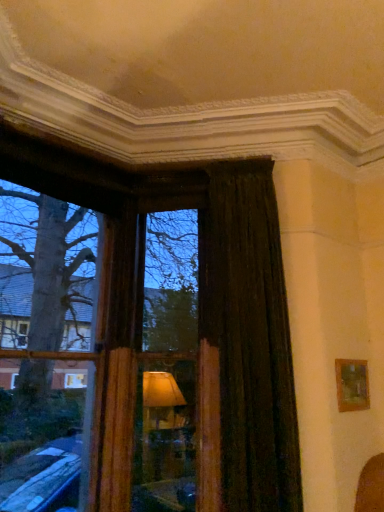
Question: Should I look upward or downward to see wooden picture frame at right?

Choices:
 (A) up
 (B) down

Answer: (B)

Question: Is wooden picture frame at right aimed at wooden frame at left?

Choices:
 (A) yes
 (B) no

Answer: (B)

Question: Considering the relative sizes of wooden picture frame at right and wooden frame at left in the image provided, is wooden picture frame at right taller than wooden frame at left?

Choices:
 (A) yes
 (B) no

Answer: (B)

Question: Is wooden picture frame at right shorter than wooden frame at left?

Choices:
 (A) yes
 (B) no

Answer: (A)

Question: From the image's perspective, is wooden picture frame at right under wooden frame at left?

Choices:
 (A) yes
 (B) no

Answer: (A)

Question: Is wooden picture frame at right outside wooden frame at left?

Choices:
 (A) yes
 (B) no

Answer: (A)

Question: Is wooden picture frame at right bigger than wooden frame at left?

Choices:
 (A) no
 (B) yes

Answer: (A)

Question: Can you confirm if wooden picture frame at right is bigger than wooden frame at center?

Choices:
 (A) yes
 (B) no

Answer: (B)

Question: Does wooden picture frame at right have a greater width compared to wooden frame at center?

Choices:
 (A) no
 (B) yes

Answer: (A)

Question: From the image's perspective, is wooden picture frame at right on wooden frame at center?

Choices:
 (A) no
 (B) yes

Answer: (A)

Question: Is wooden picture frame at right positioned in front of wooden frame at center?

Choices:
 (A) no
 (B) yes

Answer: (A)

Question: Does wooden picture frame at right have a lesser width compared to wooden frame at center?

Choices:
 (A) yes
 (B) no

Answer: (A)

Question: Is wooden picture frame at right oriented towards wooden frame at center?

Choices:
 (A) yes
 (B) no

Answer: (B)

Question: Is the position of dark velvet curtain at right more distant than that of wooden frame at center?

Choices:
 (A) yes
 (B) no

Answer: (B)